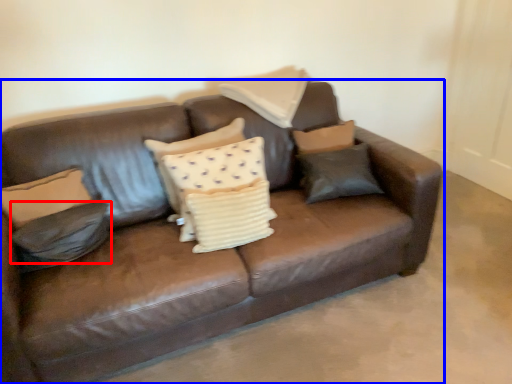
Question: Which of the following is the closest to the observer, pillow (highlighted by a red box) or studio couch (highlighted by a blue box)?

Choices:
 (A) pillow
 (B) studio couch

Answer: (B)